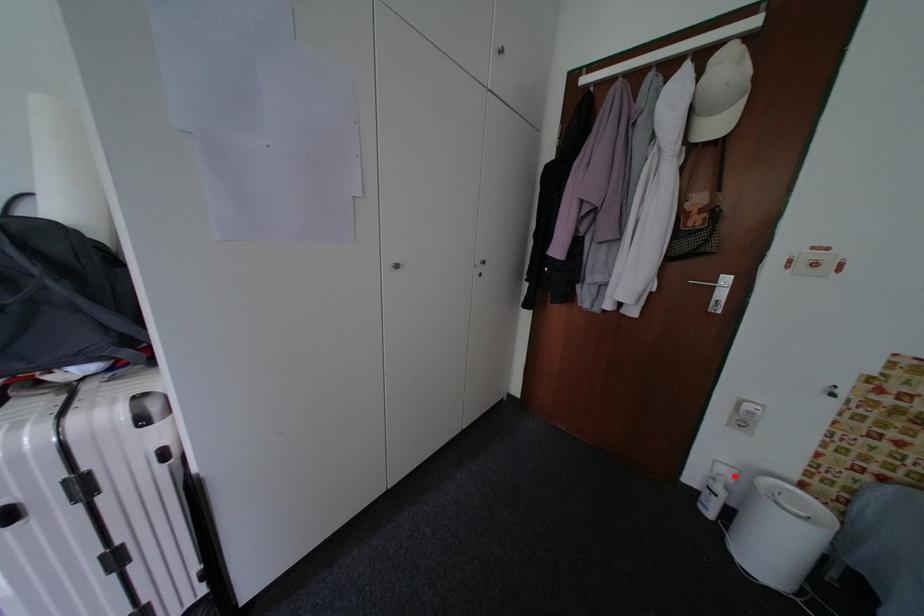
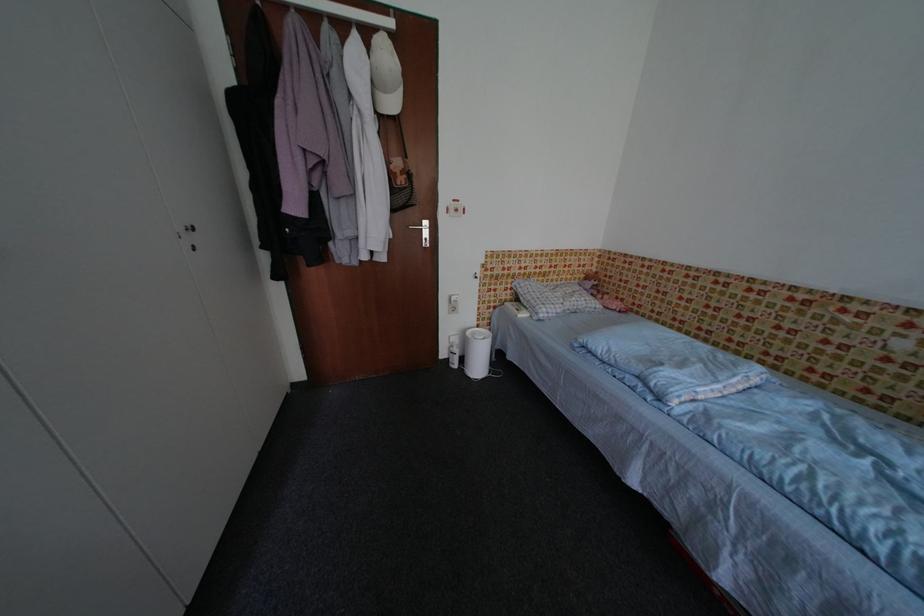
Where in the second image is the point corresponding to the highlighted location from the first image?

(464, 342)